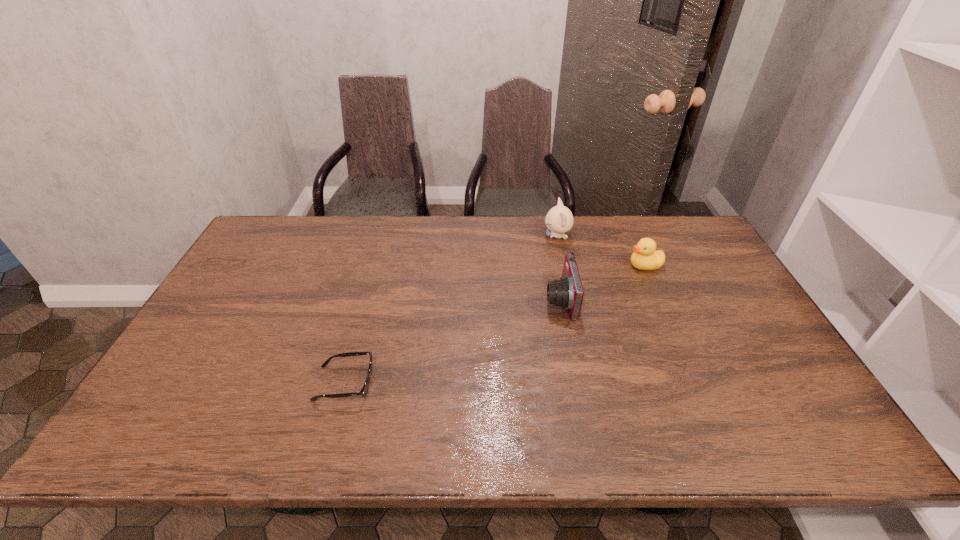
Locate an element on the screen. The width and height of the screenshot is (960, 540). blank region between the duck and the second nearest object is located at coordinates (602, 282).

The width and height of the screenshot is (960, 540). In order to click on empty space that is in between the farthest object and the rightmost object in this screenshot , I will do `click(601, 251)`.

Select which object appears as the third closest to the leftmost object. Please provide its 2D coordinates. Your answer should be formatted as a tuple, i.e. [(x, y)], where the tuple contains the x and y coordinates of a point satisfying the conditions above.

[(645, 257)]

Locate which object ranks in proximity to the duck. Please provide its 2D coordinates. Your answer should be formatted as a tuple, i.e. [(x, y)], where the tuple contains the x and y coordinates of a point satisfying the conditions above.

[(559, 219)]